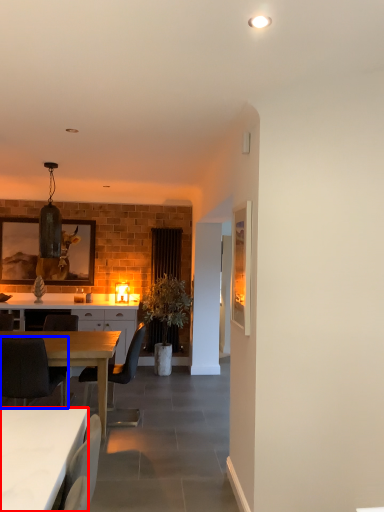
Question: Which point is further to the camera, desk (highlighted by a red box) or chair (highlighted by a blue box)?

Choices:
 (A) desk
 (B) chair

Answer: (B)